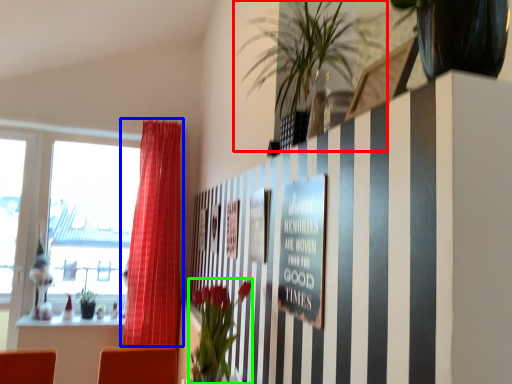
Question: Based on their relative distances, which object is nearer to houseplant (highlighted by a red box)? Choose from curtain (highlighted by a blue box) and floral arrangement (highlighted by a green box).

Choices:
 (A) curtain
 (B) floral arrangement

Answer: (B)